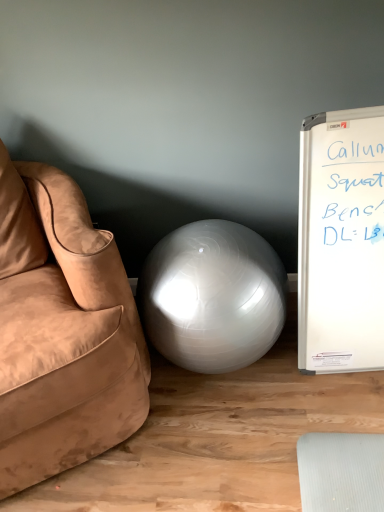
Question: Is suede brown couch at left outside of satin white ball at center?

Choices:
 (A) yes
 (B) no

Answer: (A)

Question: Considering the relative sizes of suede brown couch at left and satin white ball at center in the image provided, is suede brown couch at left shorter than satin white ball at center?

Choices:
 (A) yes
 (B) no

Answer: (B)

Question: Is suede brown couch at left positioned behind satin white ball at center?

Choices:
 (A) yes
 (B) no

Answer: (B)

Question: Is suede brown couch at left turned away from satin white ball at center?

Choices:
 (A) no
 (B) yes

Answer: (A)

Question: Are suede brown couch at left and satin white ball at center beside each other?

Choices:
 (A) yes
 (B) no

Answer: (B)

Question: Could satin white ball at center be considered to be inside suede brown couch at left?

Choices:
 (A) no
 (B) yes

Answer: (A)

Question: From a real-world perspective, is satin white ball at center positioned under suede brown couch at left based on gravity?

Choices:
 (A) no
 (B) yes

Answer: (B)

Question: Can you confirm if satin white ball at center is wider than suede brown couch at left?

Choices:
 (A) no
 (B) yes

Answer: (A)

Question: Is satin white ball at center in contact with suede brown couch at left?

Choices:
 (A) no
 (B) yes

Answer: (A)

Question: Would you say satin white ball at center contains suede brown couch at left?

Choices:
 (A) yes
 (B) no

Answer: (B)

Question: Does satin white ball at center have a greater height compared to suede brown couch at left?

Choices:
 (A) yes
 (B) no

Answer: (B)

Question: Is satin white ball at center not within suede brown couch at left?

Choices:
 (A) no
 (B) yes

Answer: (B)

Question: Is suede brown couch at left wider or thinner than satin white ball at center?

Choices:
 (A) wide
 (B) thin

Answer: (A)